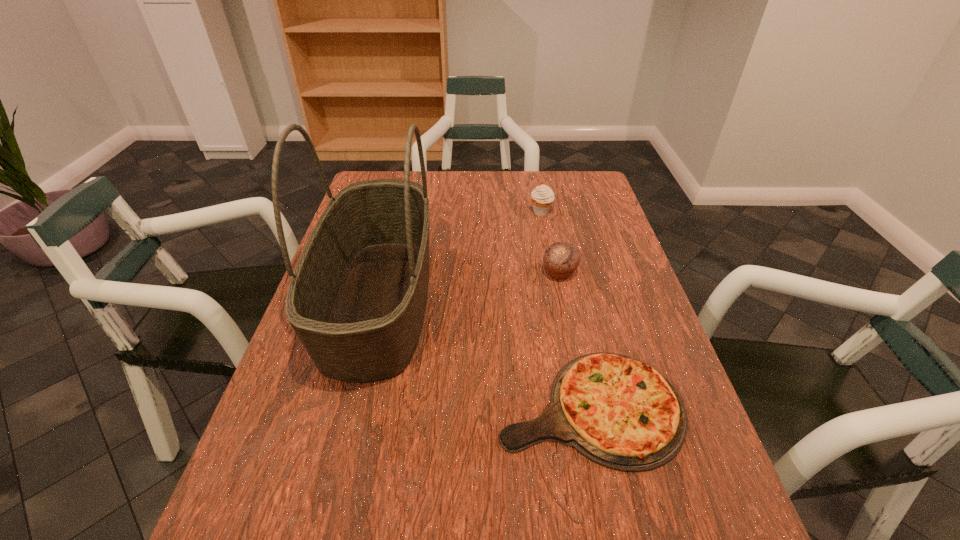
This screenshot has height=540, width=960. Find the location of `unoccupied area between the shortest object and the shorter muffin`. unoccupied area between the shortest object and the shorter muffin is located at coordinates (575, 340).

Locate an element on the screen. vacant point located between the basket and the nearer muffin is located at coordinates (469, 287).

Identify the location of free space between the farthest object and the tallest object. (460, 256).

The height and width of the screenshot is (540, 960). I want to click on vacant space that is in between the farthest object and the nearer muffin, so click(x=550, y=242).

Image resolution: width=960 pixels, height=540 pixels. I want to click on free spot between the farther muffin and the basket, so click(x=460, y=256).

At what (x,y) coordinates should I click in order to perform the action: click on free point between the shortest object and the basket. Please return your answer as a coordinate pair (x, y). Looking at the image, I should click on (485, 354).

I want to click on vacant point located between the pizza and the third tallest object, so click(575, 340).

Where is `the third closest object to the tallest object`? Image resolution: width=960 pixels, height=540 pixels. the third closest object to the tallest object is located at coordinates (542, 196).

Identify which object is the third closest to the leftmost object. Please provide its 2D coordinates. Your answer should be formatted as a tuple, i.e. [(x, y)], where the tuple contains the x and y coordinates of a point satisfying the conditions above.

[(542, 196)]

You are a GUI agent. You are given a task and a screenshot of the screen. Output one action in this format:
    pyautogui.click(x=<x>, y=<y>)
    Task: Click on the free space that satisfies the following two spatial constraints: 1. on the front side of the farthest object; 2. on the right side of the shortest object
    The image size is (960, 540).
    Given the screenshot: What is the action you would take?
    pyautogui.click(x=579, y=407)